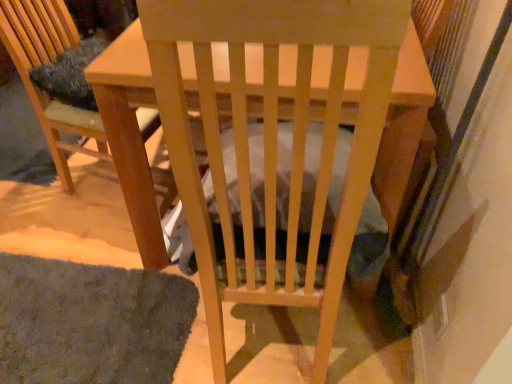
In order to face green shaggy mat at lower left, should I rotate leftwards or rightwards?

Rotate your view left by about 24.040°.

Identify the location of green shaggy mat at lower left. (91, 322).

Is wooden table at center taller or shorter than green shaggy mat at lower left?

wooden table at center is taller than green shaggy mat at lower left.

From the image's perspective, relative to green shaggy mat at lower left, is wooden table at center above or below?

wooden table at center is above green shaggy mat at lower left.

Is wooden table at center not close to green shaggy mat at lower left?

Actually, wooden table at center and green shaggy mat at lower left are a little close together.

You are a GUI agent. You are given a task and a screenshot of the screen. Output one action in this format:
    pyautogui.click(x=<x>, y=<y>)
    Task: Click on the table above the green shaggy mat at lower left (from a real-world perspective)
    This screenshot has height=384, width=512.
    Given the screenshot: What is the action you would take?
    pyautogui.click(x=340, y=122)

In the image, is green shaggy mat at lower left on the left side or the right side of wooden table at center?

In the image, green shaggy mat at lower left appears on the left side of wooden table at center.

Is the depth of green shaggy mat at lower left greater than that of wooden table at center?

Yes.

Is wooden table at center positioned with its back to wooden chair at left?

wooden table at center is not turned away from wooden chair at left.

Is wooden table at center thinner than wooden chair at left?

No.

Is wooden table at center inside the boundaries of wooden chair at left, or outside?

wooden table at center is outside wooden chair at left.

From the image's perspective, is wooden table at center below wooden chair at left?

Indeed, from the image's perspective, wooden table at center is shown beneath wooden chair at left.

At what (x,y) coordinates should I click in order to perform the action: click on mat that is in front of the wooden chair at left. Please return your answer as a coordinate pair (x, y). Looking at the image, I should click on (91, 322).

Does wooden chair at left have a larger size compared to green shaggy mat at lower left?

Yes.

Which object is wider, wooden chair at left or green shaggy mat at lower left?

With larger width is wooden chair at left.

Does wooden chair at left turn towards wooden table at center?

No, wooden chair at left does not turn towards wooden table at center.

This screenshot has width=512, height=384. I want to click on table in front of the wooden chair at left, so click(x=340, y=122).

Looking at this image, can you confirm if wooden chair at left is shorter than wooden table at center?

Indeed, wooden chair at left has a lesser height compared to wooden table at center.

Considering the relative sizes of wooden chair at left and wooden table at center in the image provided, is wooden chair at left thinner than wooden table at center?

Indeed, wooden chair at left has a lesser width compared to wooden table at center.

In terms of width, does green shaggy mat at lower left look wider or thinner when compared to wooden chair at left?

Considering their sizes, green shaggy mat at lower left looks slimmer than wooden chair at left.

Does green shaggy mat at lower left turn towards wooden chair at left?

Yes, green shaggy mat at lower left is aimed at wooden chair at left.

From the image's perspective, between green shaggy mat at lower left and wooden chair at left, which one is located above?

From the image's view, wooden chair at left is above.

I want to click on table in front of the green shaggy mat at lower left, so click(x=340, y=122).

This screenshot has width=512, height=384. In the image, there is a wooden table at center. What are the coordinates of `mat below it (from a real-world perspective)` in the screenshot? It's located at (x=91, y=322).

Which object lies nearer to the anchor point green shaggy mat at lower left, wooden table at center or wooden chair at left?

Among the two, wooden table at center is located nearer to green shaggy mat at lower left.

Based on the photo, based on their spatial positions, is wooden chair at left or wooden table at center closer to green shaggy mat at lower left?

The object closer to green shaggy mat at lower left is wooden table at center.

When comparing their distances from wooden table at center, does wooden chair at left or green shaggy mat at lower left seem closer?

green shaggy mat at lower left is positioned closer to the anchor wooden table at center.

Considering their positions, is green shaggy mat at lower left positioned closer to wooden chair at left than wooden table at center?

wooden table at center is closer to wooden chair at left.

Based on their spatial positions, is green shaggy mat at lower left or wooden chair at left further from wooden table at center?

wooden chair at left.

Estimate the real-world distances between objects in this image. Which object is further from wooden chair at left, wooden table at center or green shaggy mat at lower left?

green shaggy mat at lower left is positioned further to the anchor wooden chair at left.

Find the location of a particular element. This screenshot has height=384, width=512. mat positioned between wooden table at center and wooden chair at left from near to far is located at coordinates (91, 322).